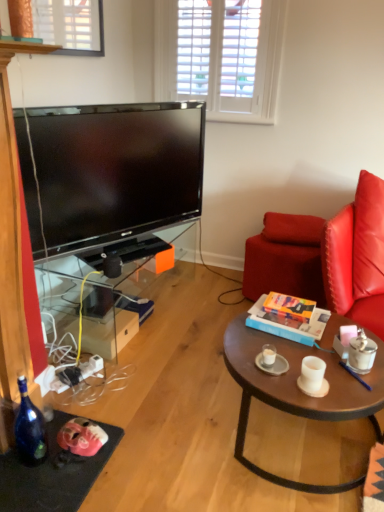
The height and width of the screenshot is (512, 384). Identify the location of vacant space to the right of white matte coffee cup at center, acting as the 1th coffee cup starting from the left. (314, 356).